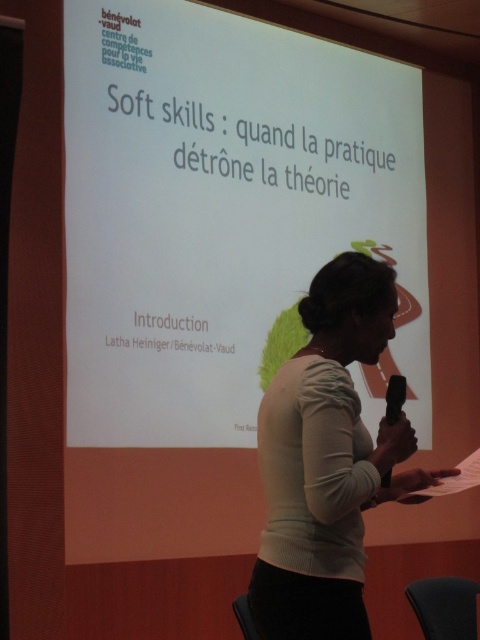
Is the position of white matte projection screen at upper center more distant than that of matte white sweater at center?

Yes, white matte projection screen at upper center is behind matte white sweater at center.

Is white matte projection screen at upper center taller than matte white sweater at center?

Yes, white matte projection screen at upper center is taller than matte white sweater at center.

Who is more distant from viewer, [348,234] or [286,420]?

Point [348,234]

Where is `white matte projection screen at upper center`? Image resolution: width=480 pixels, height=640 pixels. white matte projection screen at upper center is located at coordinates (224, 212).